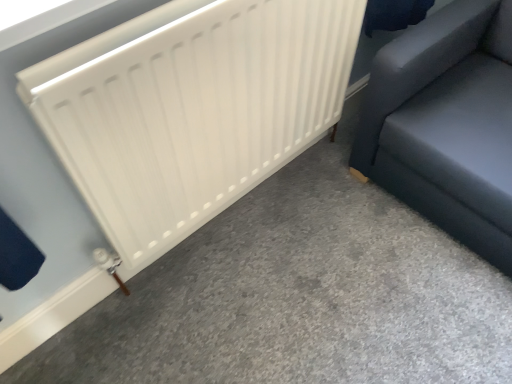
Question: Is dark gray fabric sofa at right further to the viewer compared to white matte radiator at center?

Choices:
 (A) no
 (B) yes

Answer: (B)

Question: Is the position of dark gray fabric sofa at right less distant than that of white matte radiator at center?

Choices:
 (A) no
 (B) yes

Answer: (A)

Question: Can you confirm if dark gray fabric sofa at right is shorter than white matte radiator at center?

Choices:
 (A) no
 (B) yes

Answer: (B)

Question: Is dark gray fabric sofa at right placed right next to white matte radiator at center?

Choices:
 (A) yes
 (B) no

Answer: (B)

Question: From a real-world perspective, is dark gray fabric sofa at right on white matte radiator at center?

Choices:
 (A) no
 (B) yes

Answer: (A)

Question: From the image's perspective, is dark gray fabric sofa at right located beneath white matte radiator at center?

Choices:
 (A) no
 (B) yes

Answer: (A)

Question: From the image's perspective, is white matte radiator at left over dark gray fabric sofa at right?

Choices:
 (A) yes
 (B) no

Answer: (B)

Question: Does white matte radiator at left appear on the right side of dark gray fabric sofa at right?

Choices:
 (A) yes
 (B) no

Answer: (B)

Question: From the image's perspective, is white matte radiator at left beneath dark gray fabric sofa at right?

Choices:
 (A) yes
 (B) no

Answer: (A)

Question: From a real-world perspective, does white matte radiator at left stand above dark gray fabric sofa at right?

Choices:
 (A) no
 (B) yes

Answer: (A)

Question: Would you say white matte radiator at left is outside dark gray fabric sofa at right?

Choices:
 (A) no
 (B) yes

Answer: (B)

Question: Is white matte radiator at left shorter than dark gray fabric sofa at right?

Choices:
 (A) no
 (B) yes

Answer: (B)

Question: Is white matte radiator at left at the right side of white matte radiator at center?

Choices:
 (A) no
 (B) yes

Answer: (B)